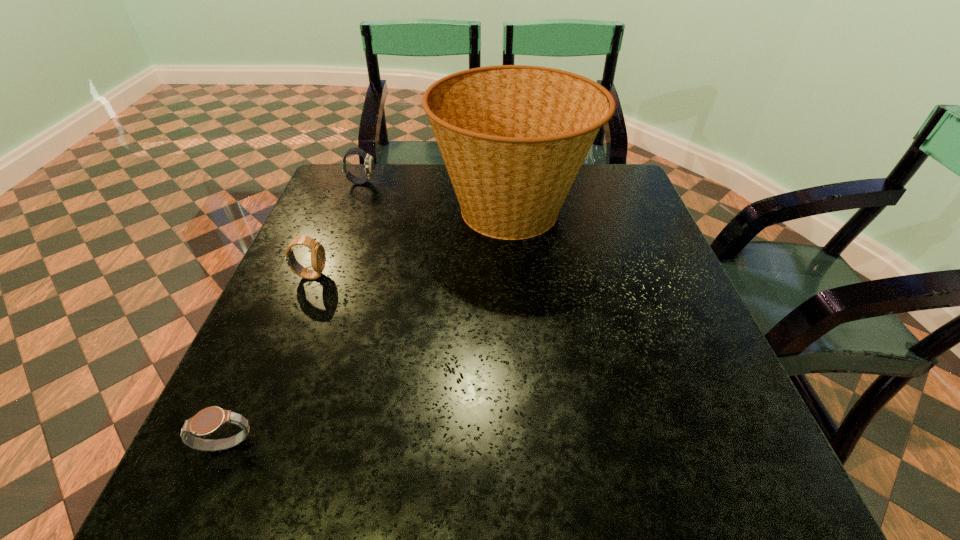
Find the location of a particular element. basket that is at the far edge is located at coordinates (513, 138).

In order to click on watch positioned at the far edge in this screenshot , I will do `click(369, 165)`.

The width and height of the screenshot is (960, 540). Find the location of `object that is at the near edge`. object that is at the near edge is located at coordinates (207, 421).

Find the location of `object located at the right edge`. object located at the right edge is located at coordinates (513, 138).

The width and height of the screenshot is (960, 540). I want to click on object present at the far left corner, so click(369, 165).

Find the location of a particular element. The height and width of the screenshot is (540, 960). object that is at the near left corner is located at coordinates (207, 421).

Locate an element on the screen. The image size is (960, 540). object that is at the far right corner is located at coordinates (513, 138).

You are a GUI agent. You are given a task and a screenshot of the screen. Output one action in this format:
    pyautogui.click(x=<x>, y=<y>)
    Task: Click on the vacant space at the far edge of the desktop
    The width and height of the screenshot is (960, 540).
    Given the screenshot: What is the action you would take?
    pyautogui.click(x=422, y=170)

Find the location of `vacant space at the near edge`. vacant space at the near edge is located at coordinates (657, 504).

I want to click on vacant space at the left edge of the desktop, so click(288, 340).